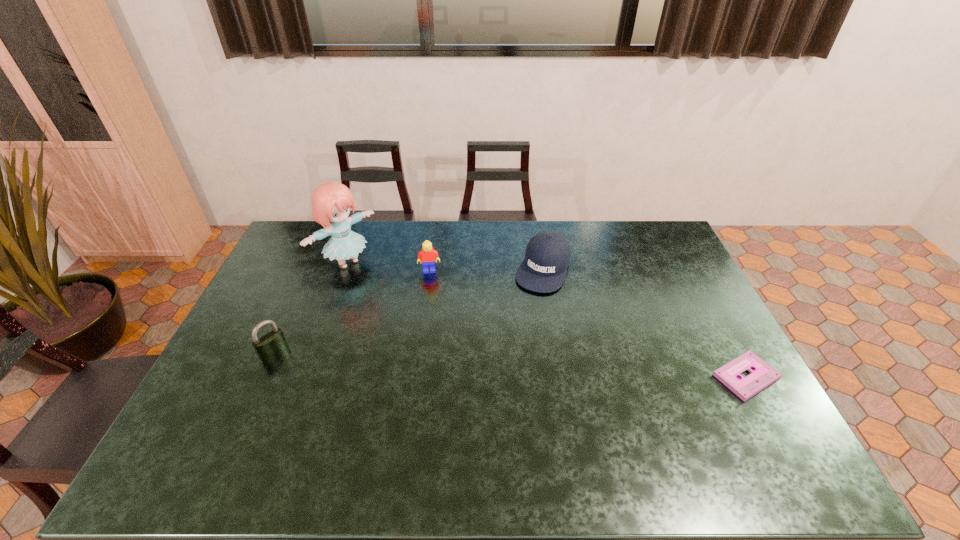
Identify the location of vacant space located on the front-facing side of the third object from right to left. (433, 313).

This screenshot has width=960, height=540. Find the location of `vacant area situated 0.250m on the front-facing side of the third object from right to left`. vacant area situated 0.250m on the front-facing side of the third object from right to left is located at coordinates (434, 326).

Locate an element on the screen. vacant space located 0.090m on the front-facing side of the baseball cap is located at coordinates click(x=528, y=311).

Image resolution: width=960 pixels, height=540 pixels. Find the location of `free region located 0.180m on the front-facing side of the baseball cap`. free region located 0.180m on the front-facing side of the baseball cap is located at coordinates click(520, 331).

The height and width of the screenshot is (540, 960). What are the coordinates of `vacant space located 0.160m on the front-facing side of the baseball cap` in the screenshot? It's located at (522, 326).

I want to click on free space located 0.060m on the front-facing side of the tallest object, so click(x=373, y=284).

Locate an element on the screen. This screenshot has height=540, width=960. free region located 0.160m on the front-facing side of the tallest object is located at coordinates (392, 298).

Identify the location of blank area located on the front-facing side of the tallest object. Image resolution: width=960 pixels, height=540 pixels. (405, 308).

Identify the location of baseball cap that is at the far edge. This screenshot has width=960, height=540. (547, 256).

Identify the location of doll that is positioned at the far edge. This screenshot has height=540, width=960. (331, 201).